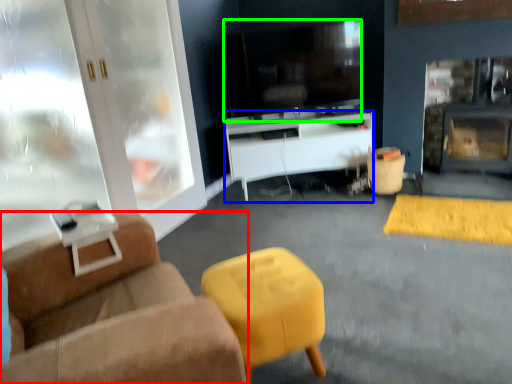
Question: Considering the real-world distances, which object is farthest from studio couch (highlighted by a red box)? desk (highlighted by a blue box) or television (highlighted by a green box)?

Choices:
 (A) desk
 (B) television

Answer: (B)